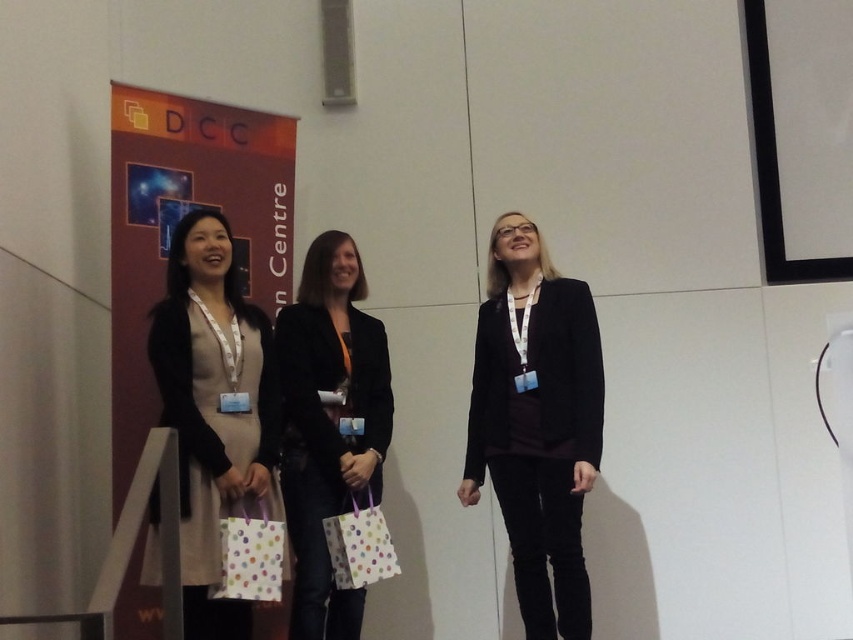
Consider the image. You are standing in the conference room and need to locate the beige fabric dress at left. According to the coordinates provided, where should you look to find it?

The beige fabric dress at left is located at coordinates point (213, 410).

You are organizing a photo shoot for a clothing brand and need to ensure that the models are arranged in order of their clothing width. Given the two blazers in the scene, the matte black blazer at center and the black matte blazer at center, which one should be placed first if you want to arrange them from widest to narrowest?

The matte black blazer at center should be placed first because its width surpasses the black matte blazer at center, making it wider.